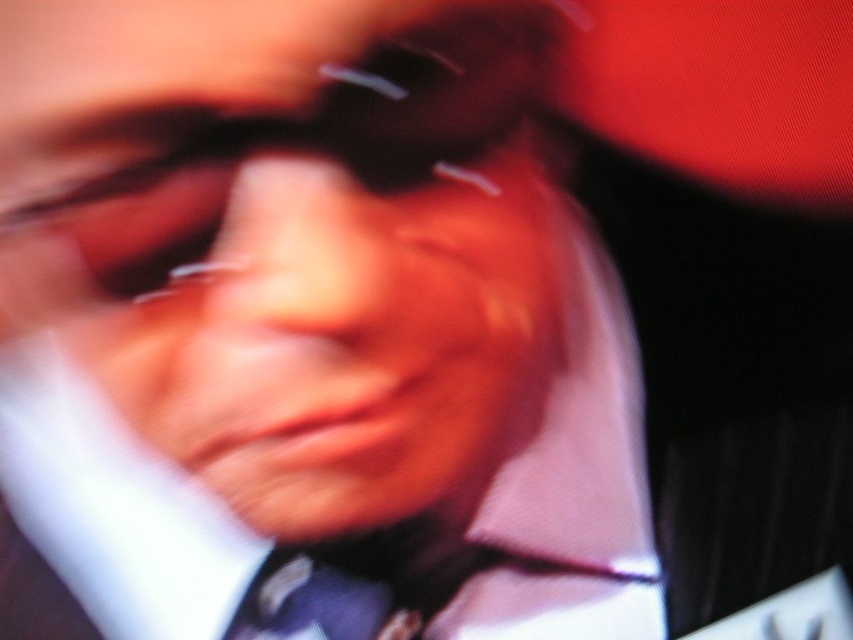
You are holding a ruler and want to measure the distance from your eyes to the point at coordinates point (x=495, y=240) in the image. What is the actual distance in inches?

The point at coordinates point (x=495, y=240) is 11.94 inches away from the viewer.

Based on the scene description, can you determine if the matte white face at center is wider than the dark blue textured tie at center?

The matte white face at center is wider than the dark blue textured tie at center according to the objects description.

You are a photographer who needs to adjust the focus of your camera. You notice the matte white face at center and the dark blue textured tie at center in your viewfinder. Which object is taller in the frame?

The matte white face at center is taller than the dark blue textured tie at center.